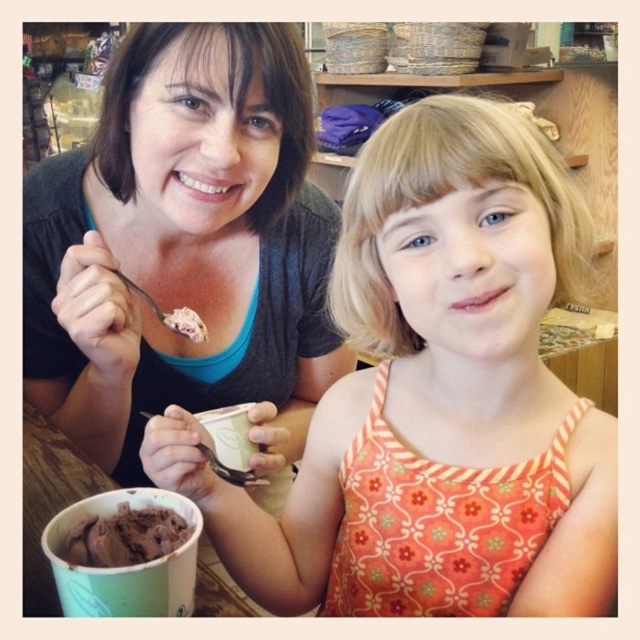
Who is lower down, orange floral tank top at center or chocolate ice cream at lower left?

chocolate ice cream at lower left is below.

Is point (611, 544) positioned in front of point (138, 528)?

No, it is not.

Where is `orange floral tank top at center`? The image size is (640, 640). orange floral tank top at center is located at coordinates (436, 397).

Can you confirm if orange floral tank top at center is wider than matte black shirt at upper left?

In fact, orange floral tank top at center might be narrower than matte black shirt at upper left.

Does orange floral tank top at center have a greater height compared to matte black shirt at upper left?

No.

Measure the distance between point (246, 579) and camera.

Point (246, 579) is 25.97 inches from camera.

Where is `orange floral tank top at center`? The width and height of the screenshot is (640, 640). orange floral tank top at center is located at coordinates (436, 397).

Locate an element on the screen. This screenshot has height=640, width=640. matte black shirt at upper left is located at coordinates (182, 246).

Where is `matte black shirt at upper left`? The image size is (640, 640). matte black shirt at upper left is located at coordinates (182, 246).